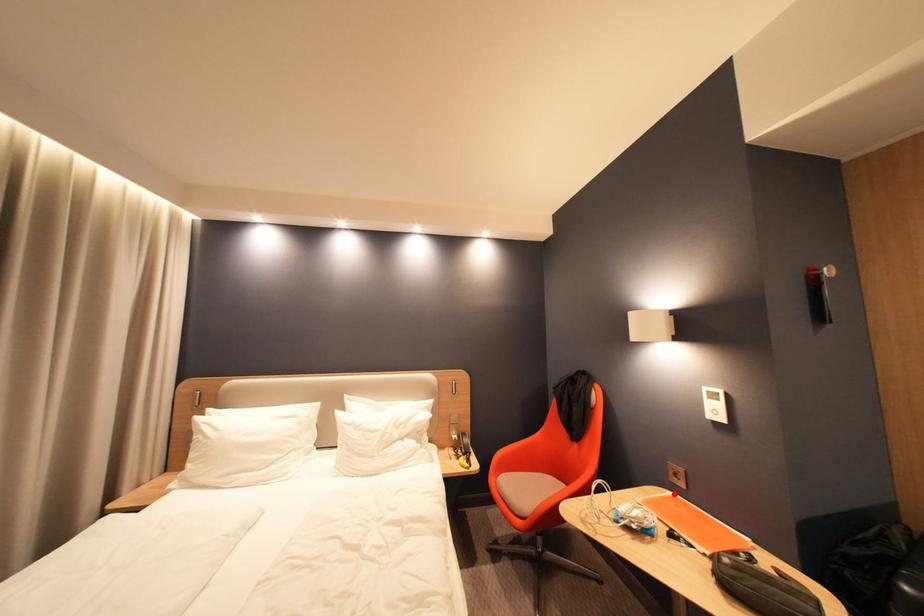
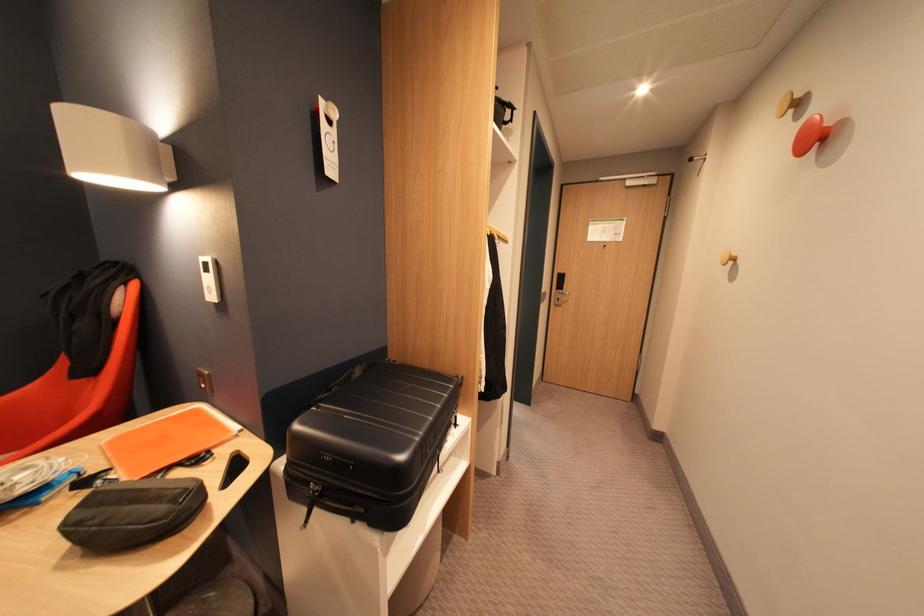
Find the pixel in the second image that matches the highlighted location in the first image.

(195, 410)